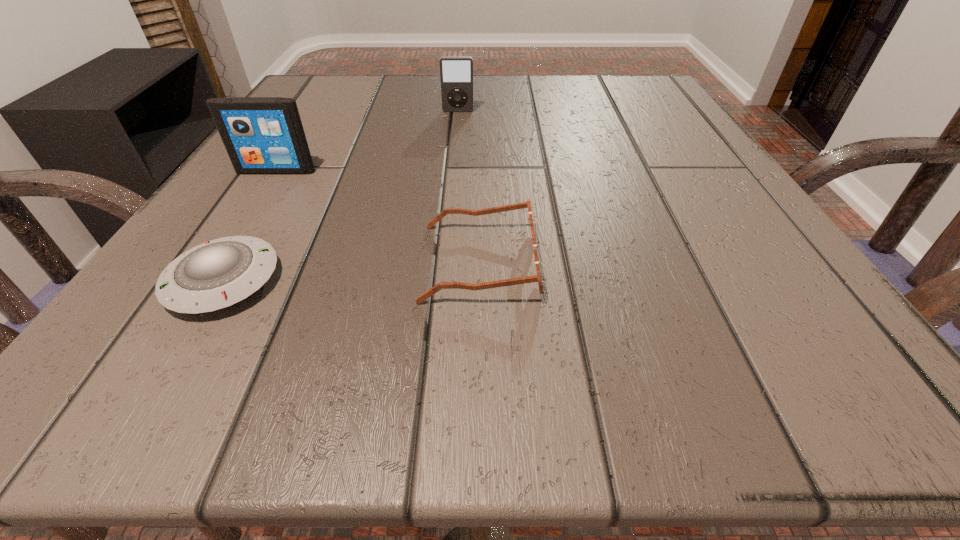
Locate an element on the screen. The width and height of the screenshot is (960, 540). object present at the far edge is located at coordinates (456, 73).

Where is `iPod located in the left edge section of the desktop`? The width and height of the screenshot is (960, 540). iPod located in the left edge section of the desktop is located at coordinates (262, 135).

Locate an element on the screen. saucer that is at the left edge is located at coordinates tap(217, 274).

Find the location of a particular element. The height and width of the screenshot is (540, 960). vacant space at the far edge of the desktop is located at coordinates (479, 110).

The height and width of the screenshot is (540, 960). In order to click on free space at the near edge of the desktop in this screenshot , I will do `click(457, 379)`.

At what (x,y) coordinates should I click in order to perform the action: click on free location at the left edge. Please return your answer as a coordinate pair (x, y). This screenshot has width=960, height=540. Looking at the image, I should click on (247, 193).

At what (x,y) coordinates should I click in order to perform the action: click on free location at the right edge of the desktop. Please return your answer as a coordinate pair (x, y). Image resolution: width=960 pixels, height=540 pixels. Looking at the image, I should click on (667, 191).

Find the location of a particular element. vacant space at the far left corner is located at coordinates (321, 76).

The height and width of the screenshot is (540, 960). In order to click on vacant space at the far right corner of the desktop in this screenshot , I will do `click(626, 77)`.

I want to click on vacant space at the near right corner of the desktop, so click(853, 345).